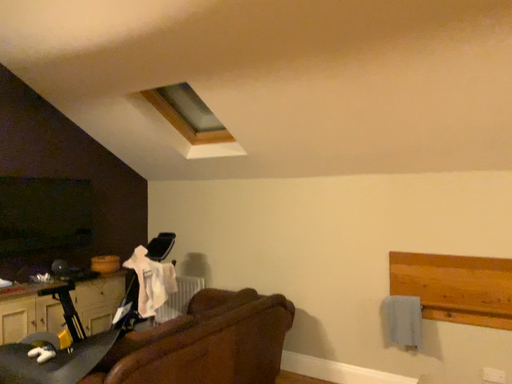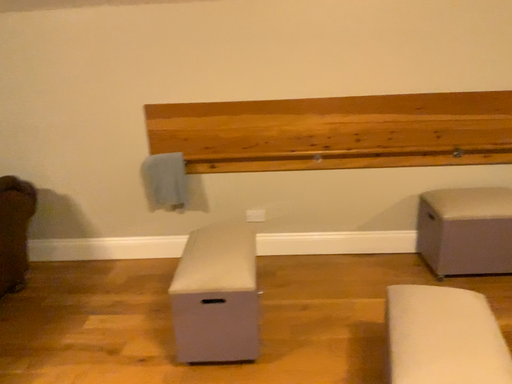
Question: Which way did the camera rotate in the video?

Choices:
 (A) rotated downward
 (B) rotated upward

Answer: (A)